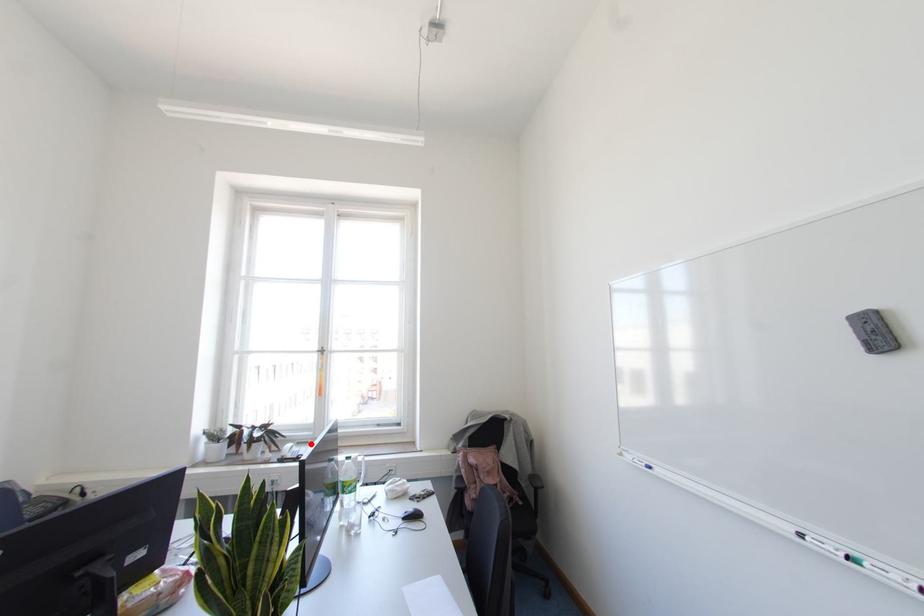
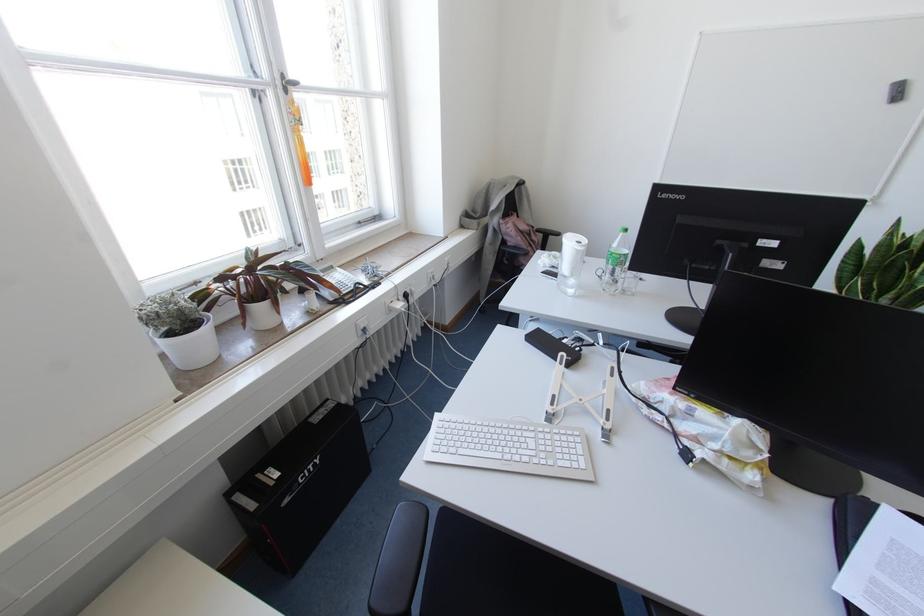
The point at the highlighted location is marked in the first image. Where is the corresponding point in the second image?

(336, 268)